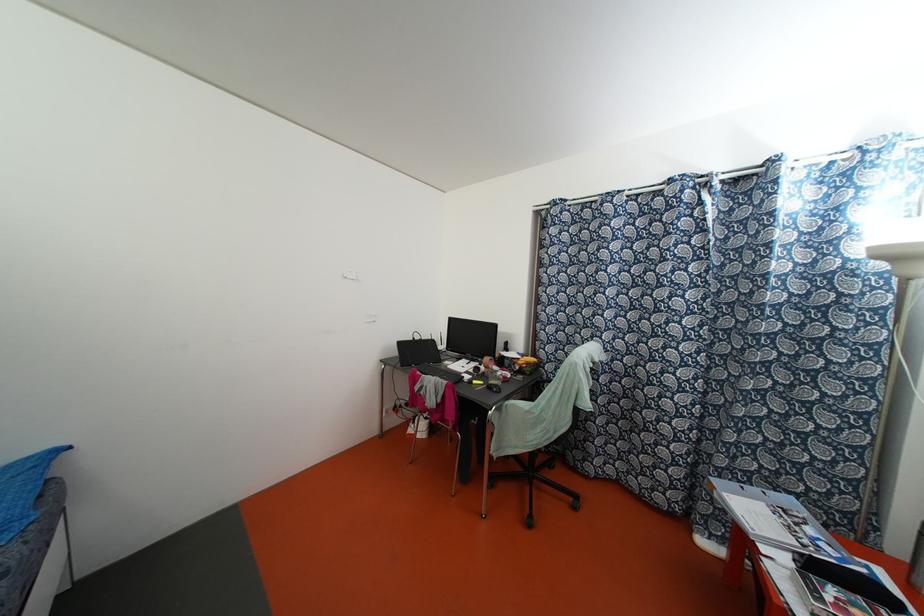
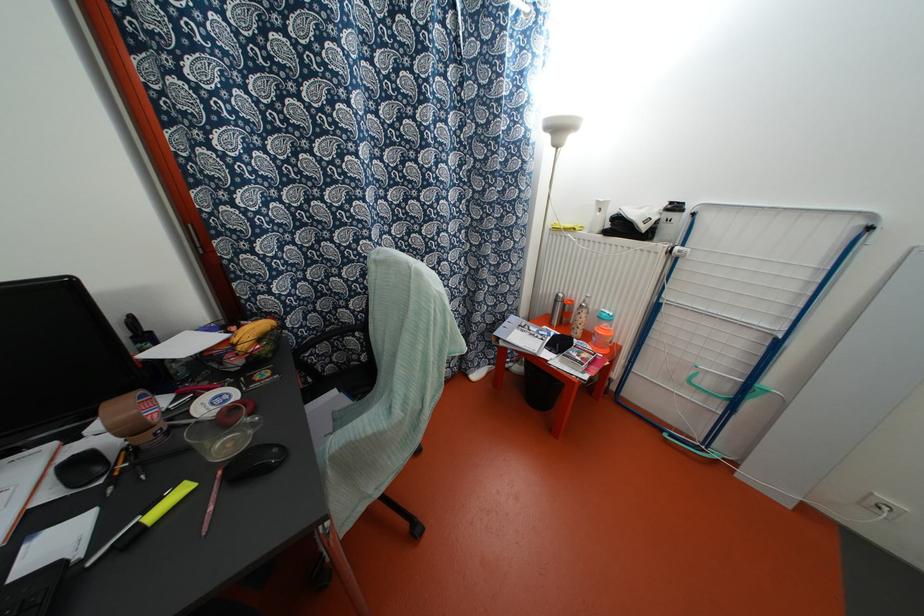
Locate, in the second image, the point that corresponds to pixel 485 367 in the first image.

(131, 429)